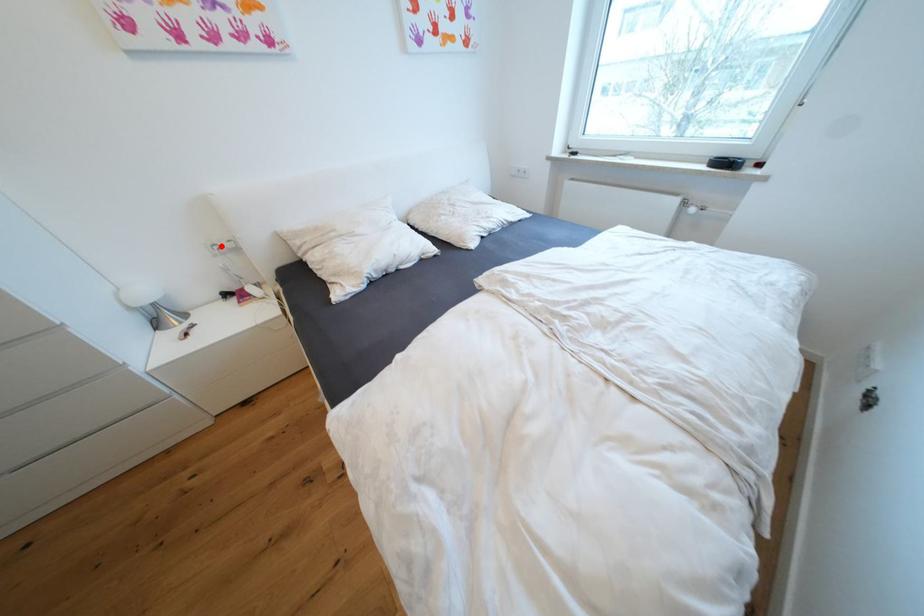
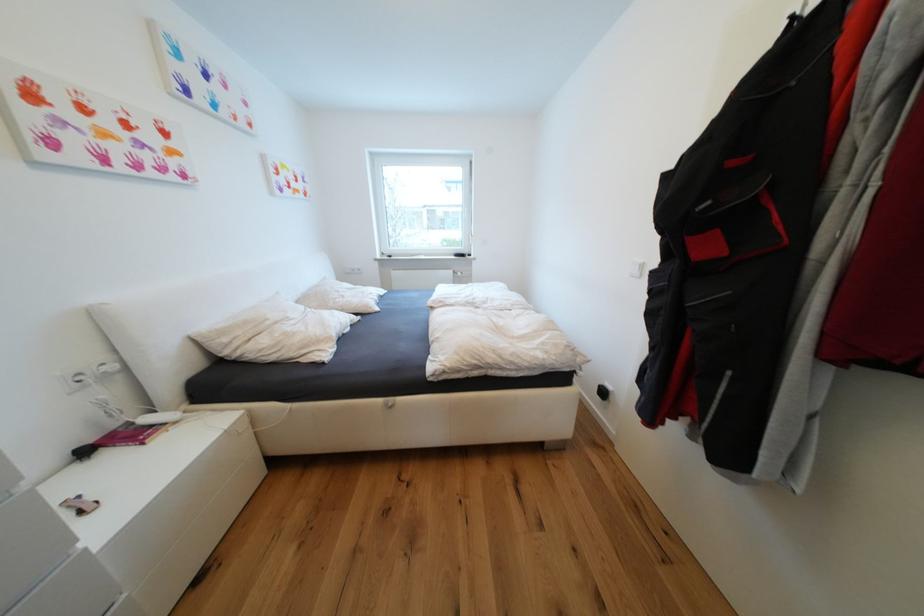
Where in the second image is the point corresponding to the highlighted location from the first image?

(87, 376)